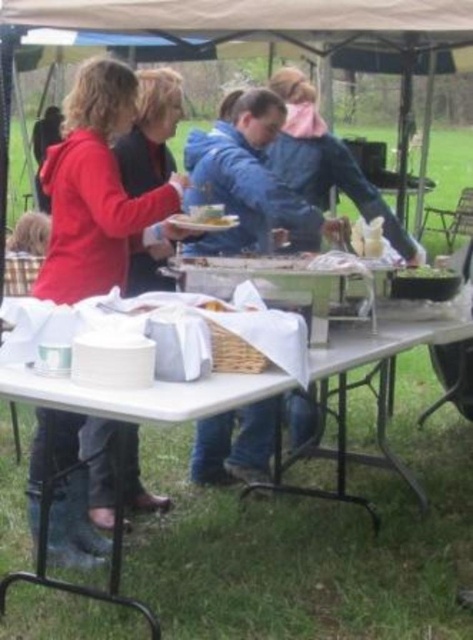
Question: Is white cloth-covered picnic table at lower center above white paper plate at center?

Choices:
 (A) no
 (B) yes

Answer: (A)

Question: Which point is farther to the camera?

Choices:
 (A) (221, 227)
 (B) (262, 182)
 (C) (164, 189)

Answer: (B)

Question: Which point is farther from the camera taking this photo?

Choices:
 (A) (230, 225)
 (B) (280, 225)
 (C) (297, 481)

Answer: (C)

Question: Is white cloth-covered picnic table at lower center above blue denim jacket at center?

Choices:
 (A) no
 (B) yes

Answer: (A)

Question: Considering the real-world distances, which object is closest to the blue denim jacket at center?

Choices:
 (A) matte red jacket at left
 (B) white paper plate at center
 (C) white cloth-covered picnic table at lower center

Answer: (B)

Question: Does white cloth-covered picnic table at lower center appear on the right side of white paper plate at center?

Choices:
 (A) yes
 (B) no

Answer: (A)